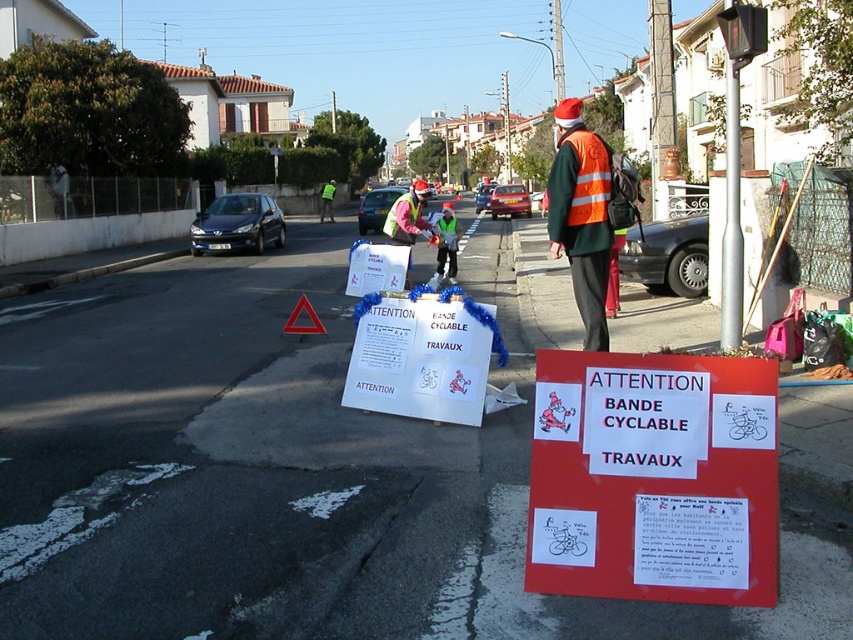
Question: Which of the following is the farthest from the observer?

Choices:
 (A) reflective orange vest at center
 (B) reflective yellow safety vest at center

Answer: (B)

Question: Is red matte sign at center positioned in front of reflective yellow safety vest at center?

Choices:
 (A) yes
 (B) no

Answer: (A)

Question: Estimate the real-world distances between objects in this image. Which object is closer to the red matte sign at center?

Choices:
 (A) reflective yellow safety vest at center
 (B) reflective orange vest at center

Answer: (B)

Question: Can you confirm if red matte sign at center is smaller than reflective orange vest at center?

Choices:
 (A) yes
 (B) no

Answer: (A)

Question: Among these objects, which one is farthest from the camera?

Choices:
 (A) reflective yellow safety vest at center
 (B) red matte sign at center

Answer: (A)

Question: Observing the image, what is the correct spatial positioning of reflective orange vest at center in reference to reflective yellow safety vest at center?

Choices:
 (A) left
 (B) right

Answer: (B)